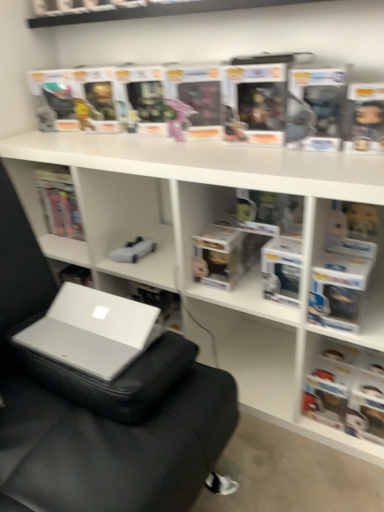
Question: From the image's perspective, is matte black book at right located above or below gray fabric bean bag chair at center?

Choices:
 (A) below
 (B) above

Answer: (A)

Question: Is matte black book at right taller or shorter than gray fabric bean bag chair at center?

Choices:
 (A) tall
 (B) short

Answer: (B)

Question: Which is farther from the gray fabric bean bag chair at center?

Choices:
 (A) silver/glossy laptop at lower left
 (B) matte black book at right

Answer: (B)

Question: Which is farther from the silver/glossy laptop at lower left?

Choices:
 (A) gray fabric bean bag chair at center
 (B) matte black book at right

Answer: (B)